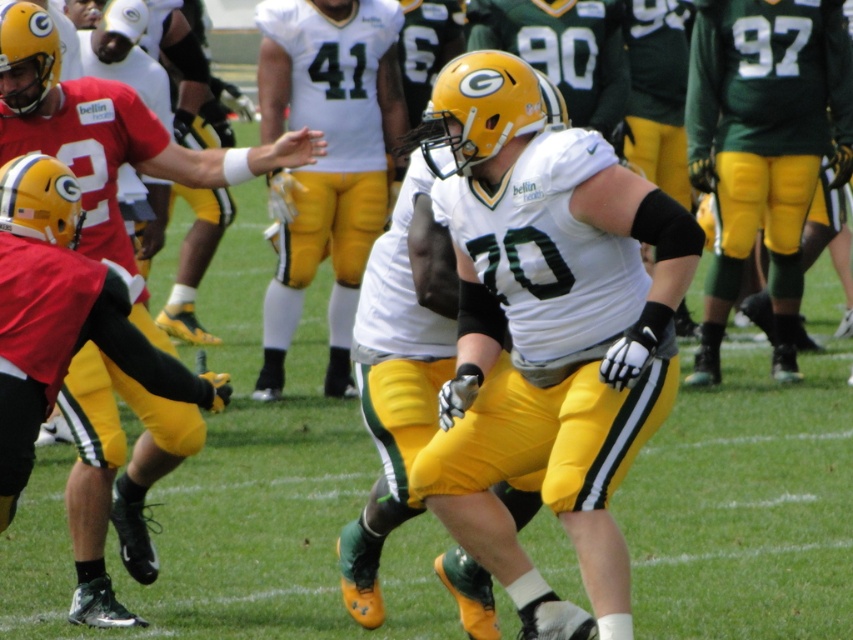
Question: Is matte black jersey at center to the left of matte green jersey at center from the viewer's perspective?

Choices:
 (A) yes
 (B) no

Answer: (A)

Question: Which of the following is the farthest from the observer?

Choices:
 (A) matte green jersey at center
 (B) white matte jersey at center
 (C) white jersey at center
 (D) matte black jersey at center

Answer: (A)

Question: Among these points, which one is farthest from the camera?

Choices:
 (A) (90, 458)
 (B) (671, 362)

Answer: (A)

Question: Which object is positioned closest to the matte green jersey at center?

Choices:
 (A) white matte jersey at center
 (B) white jersey at center
 (C) matte black jersey at center

Answer: (B)

Question: Can you confirm if matte black jersey at center is smaller than matte green jersey at center?

Choices:
 (A) yes
 (B) no

Answer: (B)

Question: Does matte green jersey at center have a larger size compared to white jersey at center?

Choices:
 (A) yes
 (B) no

Answer: (B)